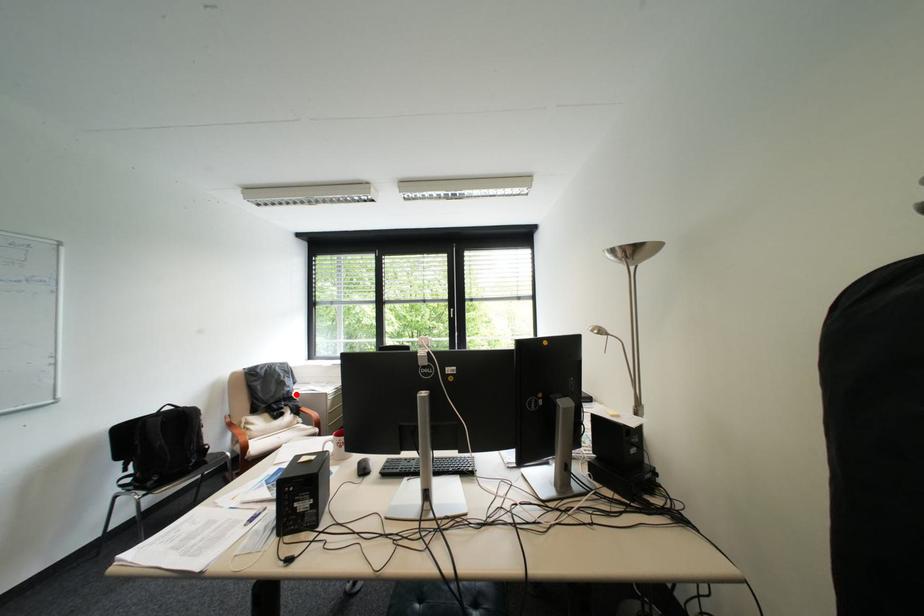
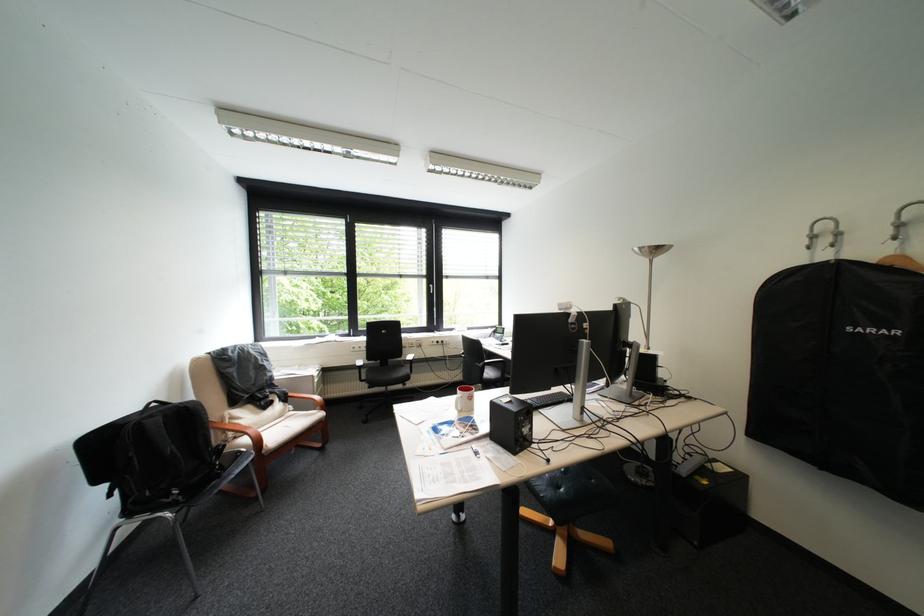
Question: I am providing you with two images of the same scene from different viewpoints. A red point is marked on the first image. At the location where the point appears in image 1, is it still visible in image 2?

Choices:
 (A) Yes
 (B) No

Answer: (A)